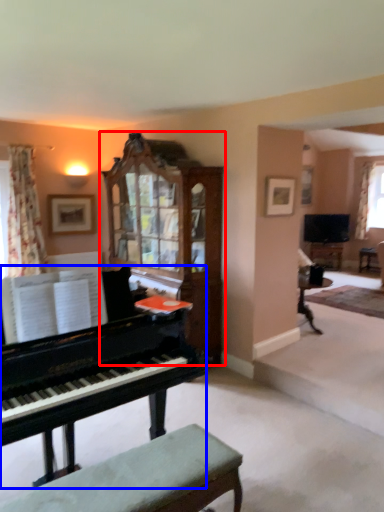
Question: Which object is further to the camera taking this photo, cabinetry (highlighted by a red box) or piano (highlighted by a blue box)?

Choices:
 (A) cabinetry
 (B) piano

Answer: (A)